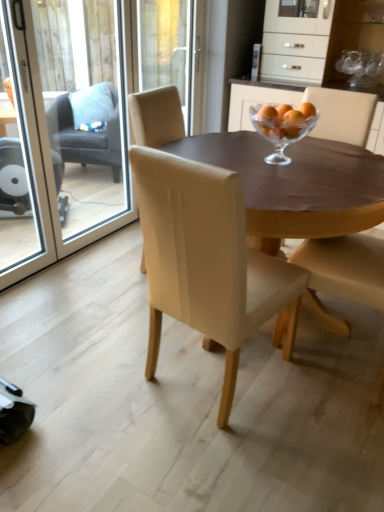
Identify the location of vacant space to the right of clear glass bowl at center. (345, 159).